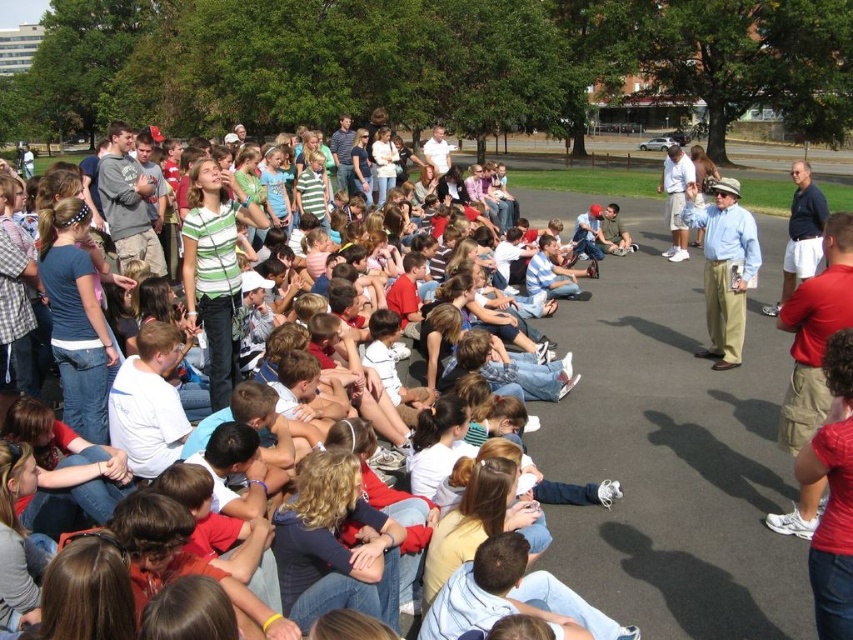
Can you confirm if striped shirt at center is positioned to the right of light blue shirt at center?

Incorrect, striped shirt at center is not on the right side of light blue shirt at center.

You are a GUI agent. You are given a task and a screenshot of the screen. Output one action in this format:
    pyautogui.click(x=<x>, y=<y>)
    Task: Click on the striped shirt at center
    
    Given the screenshot: What is the action you would take?
    pyautogui.click(x=100, y=330)